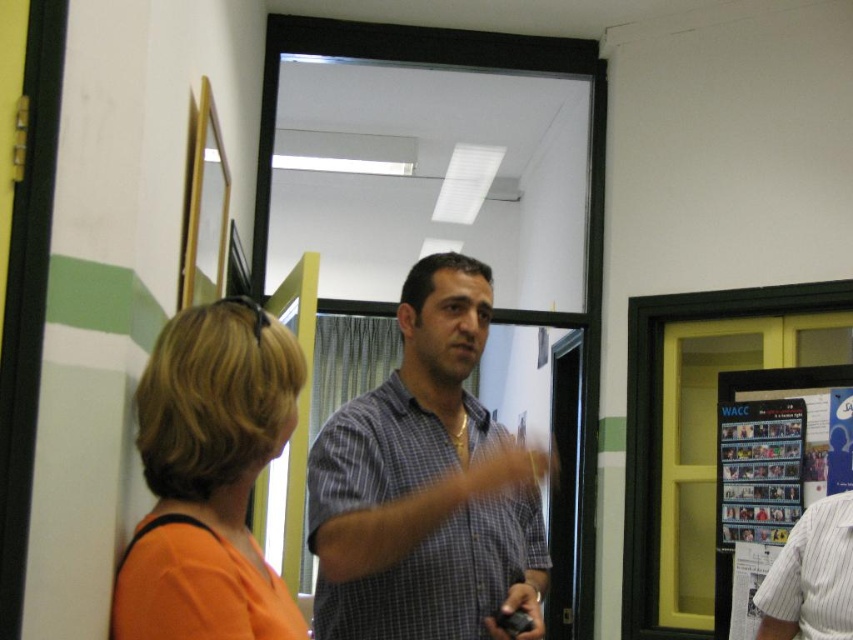
Question: Among these objects, which one is nearest to the camera?

Choices:
 (A) white striped shirt at right
 (B) black plastic remote at center
 (C) checkered fabric shirt at center
 (D) orange fabric shirt at left

Answer: (D)

Question: From the image, what is the correct spatial relationship of white striped shirt at right in relation to black plastic remote at center?

Choices:
 (A) above
 (B) below

Answer: (B)

Question: Can you confirm if orange fabric shirt at left is bigger than white striped shirt at right?

Choices:
 (A) yes
 (B) no

Answer: (A)

Question: Which object is farther from the camera taking this photo?

Choices:
 (A) black plastic remote at center
 (B) white striped shirt at right

Answer: (B)

Question: Can you confirm if checkered fabric shirt at center is bigger than orange fabric shirt at left?

Choices:
 (A) yes
 (B) no

Answer: (A)

Question: Which point is closer to the camera?

Choices:
 (A) (519, 628)
 (B) (360, 544)

Answer: (B)